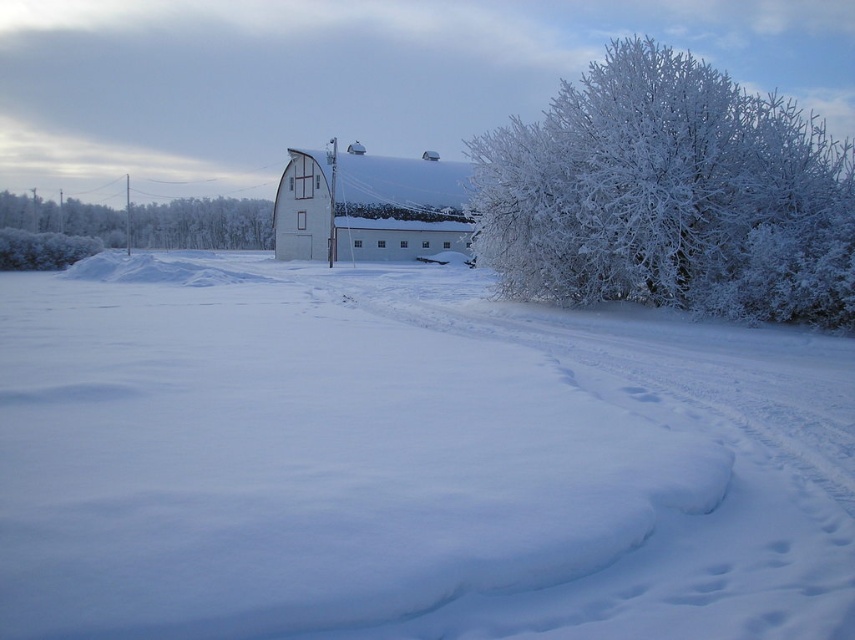
Describe the element at coordinates (670, 195) in the screenshot. This screenshot has height=640, width=855. I see `frosted white bush at right` at that location.

How much distance is there between frosted white bush at right and white matte barn at center?

frosted white bush at right and white matte barn at center are 40.41 meters apart from each other.

Locate an element on the screen. Image resolution: width=855 pixels, height=640 pixels. frosted white bush at right is located at coordinates 670,195.

Between white matte barn at center and white frosty bush at left, which one has more height?

With more height is white matte barn at center.

Looking at this image, can you confirm if white matte barn at center is shorter than white frosty bush at left?

In fact, white matte barn at center may be taller than white frosty bush at left.

Find the location of a particular element. This screenshot has height=640, width=855. white matte barn at center is located at coordinates (370, 205).

Identify the location of white matte barn at center. (370, 205).

Is white fluffy snow at center positioned before white matte barn at center?

Yes, it is in front of white matte barn at center.

Is white fluffy snow at center below white matte barn at center?

Indeed, white fluffy snow at center is positioned under white matte barn at center.

In order to click on white fluffy snow at center in this screenshot , I will do `click(410, 461)`.

Identify the location of white fluffy snow at center. The width and height of the screenshot is (855, 640). (410, 461).